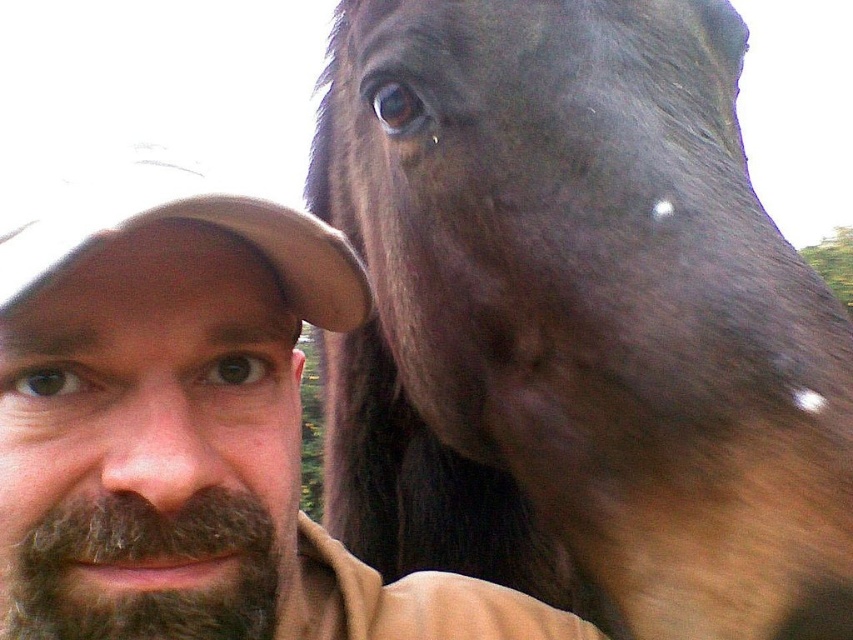
Does brown beard at left have a smaller size compared to tan fabric baseball cap at left?

Actually, brown beard at left might be larger than tan fabric baseball cap at left.

Does point (222, 579) come in front of point (231, 186)?

That is False.

Is point (125, 515) behind point (15, 291)?

That is True.

Where is `brown beard at left`? This screenshot has height=640, width=853. brown beard at left is located at coordinates (187, 429).

Based on the photo, can you confirm if brown beard at left is smaller than brown skin/naturalobject at left?

No, brown beard at left is not smaller than brown skin/naturalobject at left.

Is point (207, 387) positioned behind point (171, 440)?

Yes, point (207, 387) is farther from viewer.

Who is more forward, (x=248, y=481) or (x=206, y=412)?

Point (x=206, y=412)

Image resolution: width=853 pixels, height=640 pixels. What are the coordinates of `brown beard at left` in the screenshot? It's located at (187, 429).

In the scene shown: Does tan fabric baseball cap at left appear on the right side of brown skin/naturalobject at left?

Correct, you'll find tan fabric baseball cap at left to the right of brown skin/naturalobject at left.

Who is higher up, tan fabric baseball cap at left or brown skin/naturalobject at left?

tan fabric baseball cap at left

Which is in front, point (108, 234) or point (164, 490)?

Positioned in front is point (108, 234).

I want to click on tan fabric baseball cap at left, so [x=183, y=218].